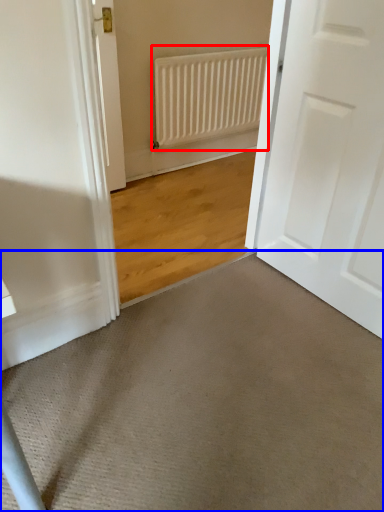
Question: Which point is closer to the camera, radiator (highlighted by a red box) or doormat (highlighted by a blue box)?

Choices:
 (A) radiator
 (B) doormat

Answer: (B)